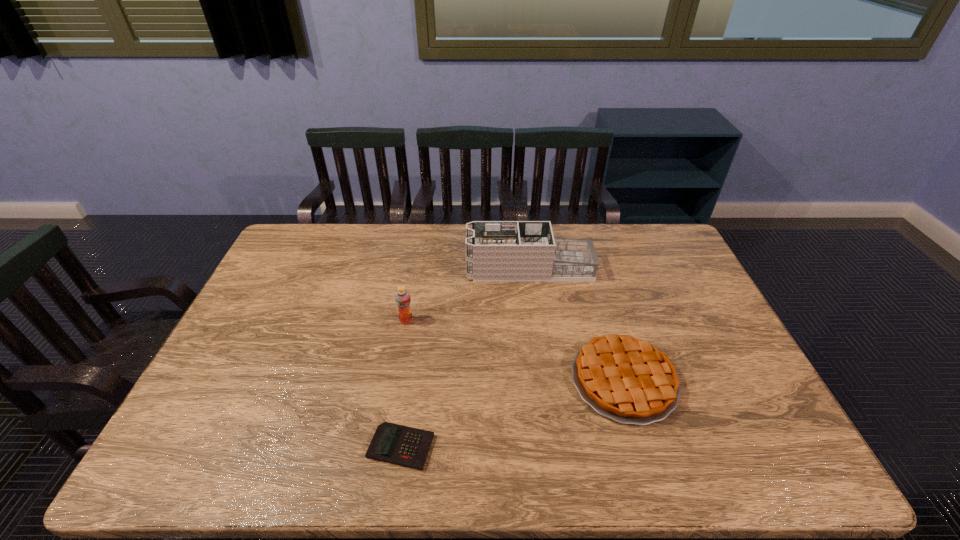
Find the location of `the farthest object`. the farthest object is located at coordinates (496, 251).

Locate an element on the screen. orange juice is located at coordinates (402, 297).

The height and width of the screenshot is (540, 960). I want to click on the second shortest object, so click(628, 380).

Find the location of a particular element. The height and width of the screenshot is (540, 960). the shortest object is located at coordinates (401, 445).

Locate an element on the screen. This screenshot has width=960, height=540. vacant region located 0.170m at the entrance of the farthest object is located at coordinates (418, 269).

This screenshot has height=540, width=960. In order to click on blank space located 0.240m at the entrance of the farthest object in this screenshot , I will do `click(396, 269)`.

Image resolution: width=960 pixels, height=540 pixels. What are the coordinates of `free space located at the entrance of the farthest object` in the screenshot? It's located at (449, 269).

Locate an element on the screen. This screenshot has height=540, width=960. free space located 0.340m on the left of the orange juice is located at coordinates (287, 320).

Where is `vacant space located on the left of the third tallest object`? vacant space located on the left of the third tallest object is located at coordinates (541, 380).

What are the coordinates of `vacant area located on the left of the calculator` in the screenshot? It's located at (205, 447).